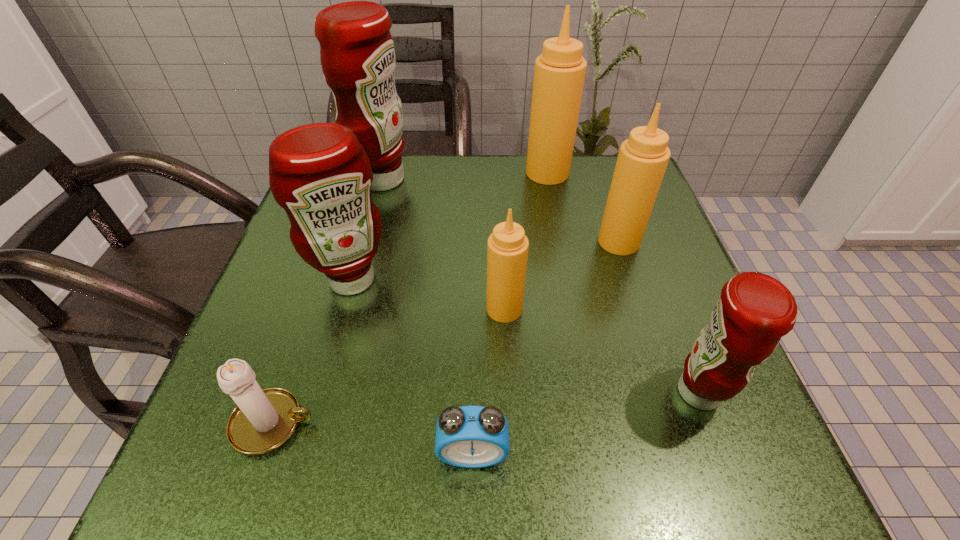
I want to click on vacant space that satisfies the following two spatial constraints: 1. on the front side of the smallest red condiment; 2. on the handle side of the seventh tallest object, so click(711, 423).

Where is `vacant space that satisfies the following two spatial constraints: 1. on the front side of the biggest tan condiment; 2. on the right side of the third farthest condiment`? The width and height of the screenshot is (960, 540). vacant space that satisfies the following two spatial constraints: 1. on the front side of the biggest tan condiment; 2. on the right side of the third farthest condiment is located at coordinates (561, 242).